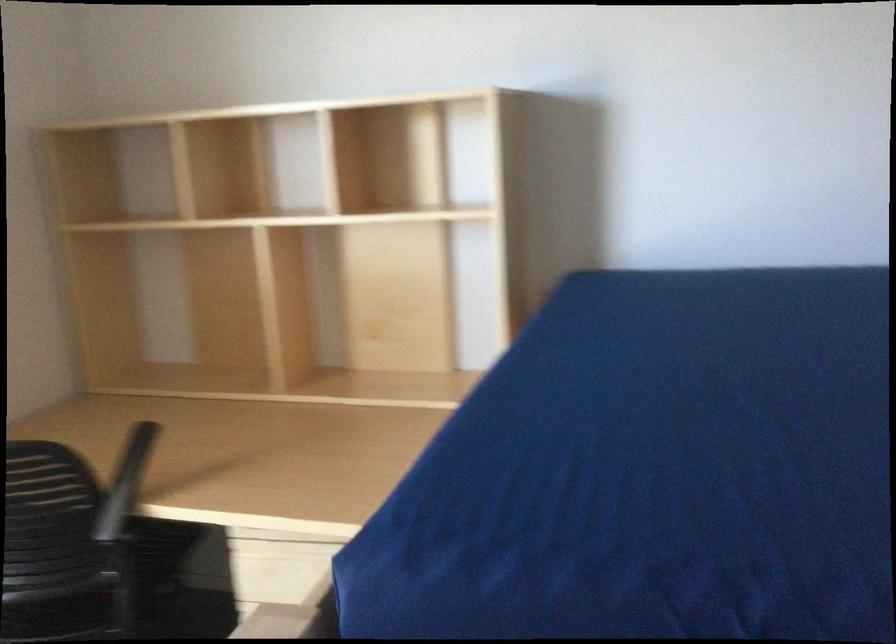
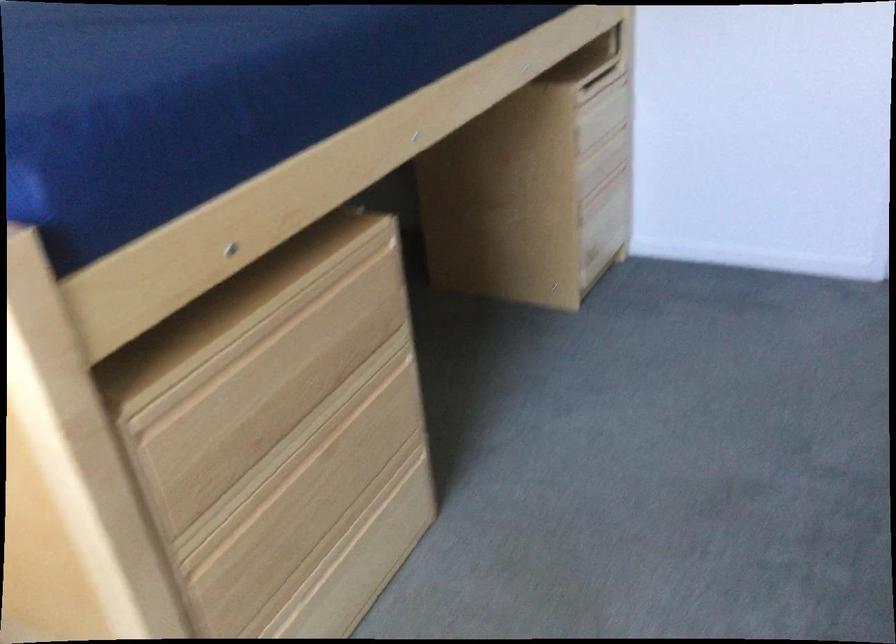
How did the camera likely rotate?

The camera rotated toward right-down.